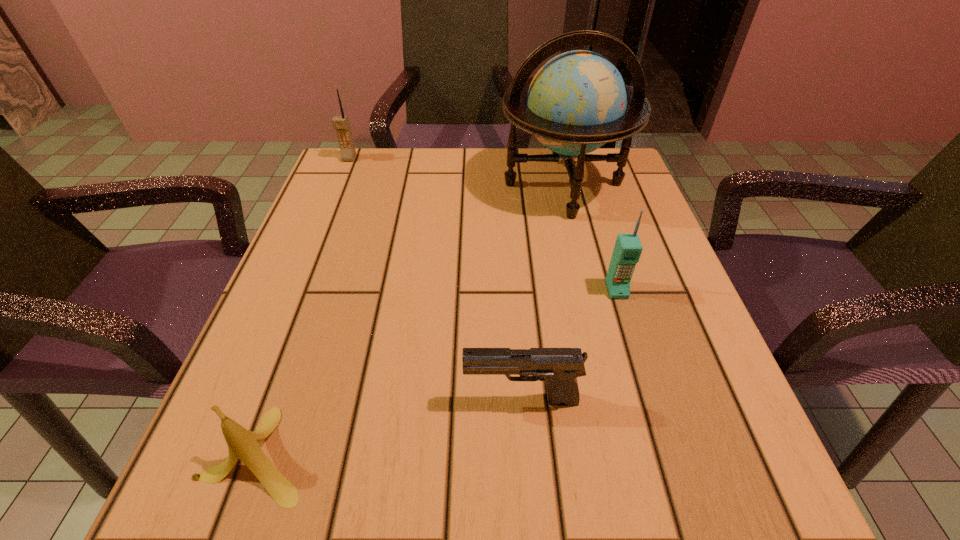
Identify the location of free space between the left cellular telephone and the pistol. The width and height of the screenshot is (960, 540). (435, 279).

Find the location of a particular element. The image size is (960, 540). empty space between the banana and the right cellular telephone is located at coordinates pyautogui.click(x=437, y=372).

Find the location of `empty space that is in between the pistol and the banana`. empty space that is in between the pistol and the banana is located at coordinates (390, 427).

Find the location of a particular element. This screenshot has width=960, height=540. empty space between the tallest object and the pistol is located at coordinates (542, 292).

This screenshot has height=540, width=960. I want to click on blank region between the tallest object and the banana, so click(x=411, y=319).

Locate an element on the screen. free spot between the farther cellular telephone and the tallest object is located at coordinates (456, 171).

In order to click on empty space that is in between the banana and the farther cellular telephone in this screenshot , I will do `click(303, 306)`.

Where is `free space between the right cellular telephone and the tallest object`? This screenshot has width=960, height=540. free space between the right cellular telephone and the tallest object is located at coordinates (589, 237).

You are a GUI agent. You are given a task and a screenshot of the screen. Output one action in this format:
    pyautogui.click(x=<x>, y=<y>)
    Task: Click on the free space that is in between the banana and the pistol
    
    Given the screenshot: What is the action you would take?
    pyautogui.click(x=390, y=427)

You are a GUI agent. You are given a task and a screenshot of the screen. Output one action in this format:
    pyautogui.click(x=<x>, y=<y>)
    Task: Click on the vacant space that is in between the nearer cellular telephone and the tallest object
    
    Given the screenshot: What is the action you would take?
    pyautogui.click(x=589, y=237)